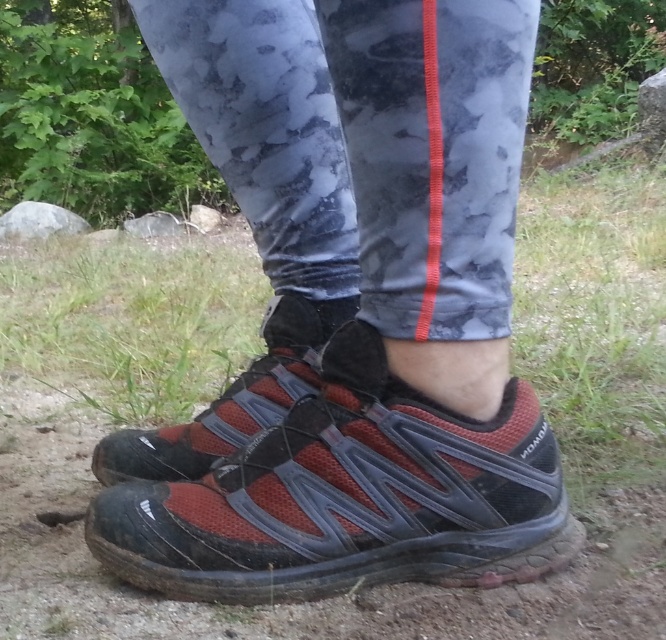
You are a hiker trying to choose between two pairs of shoes based on their width. You see the red mesh shoe at lower center and the red mesh shoe at center in the image. Which one has a wider width?

The red mesh shoe at lower center has a larger width than the red mesh shoe at center according to the description.

You are a photographer trying to capture the exact position of the matte red mesh shoe at center in the image. The coordinate system starts at the bottom left corner of the image as point 0,0. The photographer wants to know if the shoe is positioned closer to the top or bottom half of the image. Can you help determine this?

The position of the matte red mesh shoe at center is at point (x=354, y=310). Since the y coordinate is 0.532, which is above the midpoint of 0.5, the shoe is positioned closer to the top half of the image.

You are a photographer trying to capture both the red mesh shoe at lower center and the red mesh shoe at center in a single shot. Which shoe should you position closer to the left side of the frame to ensure both are visible?

Since the red mesh shoe at lower center is to the right of the red mesh shoe at center, you should position the red mesh shoe at center closer to the left side of the frame so that the red mesh shoe at lower center naturally aligns to its right, ensuring both are within the frame.